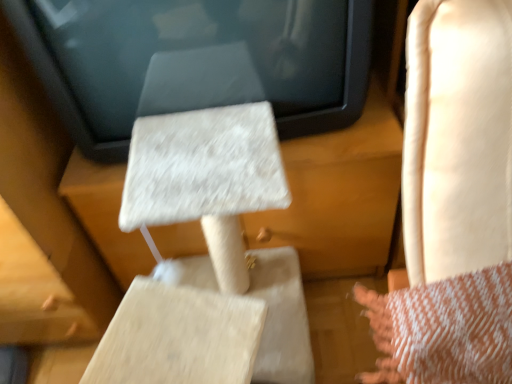
In order to face light beige leather rocking chair at right, should I rotate leftwards or rightwards?

Turn right approximately 19.824 degrees to face it.

This screenshot has height=384, width=512. What do you see at coordinates (341, 228) in the screenshot?
I see `beige textured cat tree at center` at bounding box center [341, 228].

Find the location of a particular element. The image size is (512, 384). beige textured cat tree at center is located at coordinates (341, 228).

The height and width of the screenshot is (384, 512). What do you see at coordinates (195, 60) in the screenshot? I see `white textured cat tree at center` at bounding box center [195, 60].

The image size is (512, 384). In order to click on white textured cat tree at center in this screenshot , I will do `click(195, 60)`.

Locate an element on the screen. Image resolution: width=512 pixels, height=384 pixels. light beige leather rocking chair at right is located at coordinates (453, 202).

Which object is wider, light beige leather rocking chair at right or white textured cat tree at center?

white textured cat tree at center is wider.

Looking at this image, is light beige leather rocking chair at right bigger or smaller than white textured cat tree at center?

In the image, light beige leather rocking chair at right appears to be smaller than white textured cat tree at center.

Considering the sizes of light beige leather rocking chair at right and white textured cat tree at center in the image, is light beige leather rocking chair at right taller or shorter than white textured cat tree at center?

Clearly, light beige leather rocking chair at right is taller compared to white textured cat tree at center.

Locate an element on the screen. rocking chair below the white textured cat tree at center (from the image's perspective) is located at coordinates (453, 202).

Considering the positions of objects beige textured cat tree at center and light beige leather rocking chair at right in the image provided, who is more to the right, beige textured cat tree at center or light beige leather rocking chair at right?

light beige leather rocking chair at right.

Are beige textured cat tree at center and light beige leather rocking chair at right located far from each other?

No, beige textured cat tree at center is in close proximity to light beige leather rocking chair at right.

Can you confirm if white textured cat tree at center is taller than beige textured cat tree at center?

In fact, white textured cat tree at center may be shorter than beige textured cat tree at center.

Measure the distance between white textured cat tree at center and beige textured cat tree at center.

white textured cat tree at center is 10.26 inches from beige textured cat tree at center.

Is the surface of white textured cat tree at center in direct contact with beige textured cat tree at center?

No, white textured cat tree at center is not in contact with beige textured cat tree at center.

Considering the sizes of beige textured cat tree at center and white textured cat tree at center in the image, is beige textured cat tree at center wider or thinner than white textured cat tree at center?

Considering their sizes, beige textured cat tree at center looks broader than white textured cat tree at center.

Between beige textured cat tree at center and white textured cat tree at center, which one appears on the left side from the viewer's perspective?

beige textured cat tree at center is more to the left.

From a real-world perspective, is beige textured cat tree at center below white textured cat tree at center?

Indeed, from a real-world perspective, beige textured cat tree at center is positioned beneath white textured cat tree at center.

Can you confirm if beige textured cat tree at center is shorter than white textured cat tree at center?

No, beige textured cat tree at center is not shorter than white textured cat tree at center.

From the image's perspective, is light beige leather rocking chair at right located above or below beige textured cat tree at center?

Based on their image positions, light beige leather rocking chair at right is located above beige textured cat tree at center.

From a real-world perspective, is light beige leather rocking chair at right physically above beige textured cat tree at center?

Indeed, from a real-world perspective, light beige leather rocking chair at right stands above beige textured cat tree at center.

Is point (451, 165) closer to viewer compared to point (76, 161)?

That is True.

Could you tell me if light beige leather rocking chair at right is facing beige textured cat tree at center?

No, light beige leather rocking chair at right is not turned towards beige textured cat tree at center.

Considering the sizes of objects white textured cat tree at center and light beige leather rocking chair at right in the image provided, who is wider, white textured cat tree at center or light beige leather rocking chair at right?

white textured cat tree at center.

From the image's perspective, which one is positioned lower, white textured cat tree at center or light beige leather rocking chair at right?

light beige leather rocking chair at right, from the image's perspective.

From a real-world perspective, is white textured cat tree at center under light beige leather rocking chair at right?

No.

From their relative heights in the image, would you say white textured cat tree at center is taller or shorter than light beige leather rocking chair at right?

Clearly, white textured cat tree at center is shorter compared to light beige leather rocking chair at right.

Where is `rocking chair that appears below the white textured cat tree at center (from a real-world perspective)`? rocking chair that appears below the white textured cat tree at center (from a real-world perspective) is located at coordinates (453, 202).

Locate an element on the screen. rocking chair on the right of beige textured cat tree at center is located at coordinates (453, 202).

When comparing their distances from light beige leather rocking chair at right, does beige textured cat tree at center or white textured cat tree at center seem closer?

white textured cat tree at center is positioned closer to the anchor light beige leather rocking chair at right.

Which object lies further to the anchor point white textured cat tree at center, light beige leather rocking chair at right or beige textured cat tree at center?

light beige leather rocking chair at right is positioned further to the anchor white textured cat tree at center.

From the image, which object appears to be nearer to white textured cat tree at center, beige textured cat tree at center or light beige leather rocking chair at right?

The object closer to white textured cat tree at center is beige textured cat tree at center.

From the image, which object appears to be nearer to beige textured cat tree at center, light beige leather rocking chair at right or white textured cat tree at center?

The object closer to beige textured cat tree at center is white textured cat tree at center.

Based on their spatial positions, is white textured cat tree at center or beige textured cat tree at center further from light beige leather rocking chair at right?

beige textured cat tree at center is positioned further to the anchor light beige leather rocking chair at right.

From the image, which object appears to be farther from beige textured cat tree at center, white textured cat tree at center or light beige leather rocking chair at right?

Among the two, light beige leather rocking chair at right is located further to beige textured cat tree at center.

Find the location of a particular element. This screenshot has height=384, width=512. rocking chair between white textured cat tree at center and beige textured cat tree at center from top to bottom is located at coordinates (453, 202).